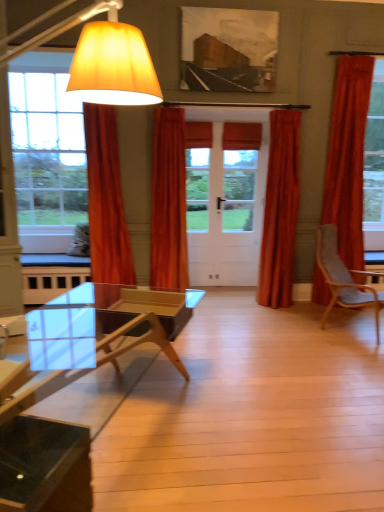
Question: Does velvet orange curtain at left, the 4th curtain viewed from the right, have a lesser height compared to velvet orange curtain at right, arranged as the 4th curtain when viewed from the left?

Choices:
 (A) no
 (B) yes

Answer: (B)

Question: Considering the relative sizes of velvet orange curtain at left, acting as the first curtain starting from the left, and velvet orange curtain at right, arranged as the 4th curtain when viewed from the left, in the image provided, is velvet orange curtain at left, acting as the first curtain starting from the left, smaller than velvet orange curtain at right, arranged as the 4th curtain when viewed from the left,?

Choices:
 (A) yes
 (B) no

Answer: (A)

Question: Could velvet orange curtain at right, placed as the 1th curtain when sorted from right to left, be considered to be inside velvet orange curtain at left, the 4th curtain viewed from the right?

Choices:
 (A) yes
 (B) no

Answer: (B)

Question: From the image's perspective, does velvet orange curtain at left, the 4th curtain viewed from the right, appear lower than velvet orange curtain at right, arranged as the 4th curtain when viewed from the left?

Choices:
 (A) no
 (B) yes

Answer: (B)

Question: Does velvet orange curtain at left, acting as the first curtain starting from the left, turn towards velvet orange curtain at right, placed as the 1th curtain when sorted from right to left?

Choices:
 (A) yes
 (B) no

Answer: (B)

Question: Is matte yellow fabric lampshade at left in front of or behind gray fabric chair at right in the image?

Choices:
 (A) front
 (B) behind

Answer: (A)

Question: From a real-world perspective, is matte yellow fabric lampshade at left positioned above or below gray fabric chair at right?

Choices:
 (A) above
 (B) below

Answer: (A)

Question: From their relative heights in the image, would you say matte yellow fabric lampshade at left is taller or shorter than gray fabric chair at right?

Choices:
 (A) tall
 (B) short

Answer: (A)

Question: Would you say matte yellow fabric lampshade at left is to the left or to the right of gray fabric chair at right in the picture?

Choices:
 (A) left
 (B) right

Answer: (A)

Question: Is transparent glass coffee table at lower left spatially inside velvet orange curtain at left, acting as the first curtain starting from the left, or outside of it?

Choices:
 (A) inside
 (B) outside

Answer: (B)

Question: Considering the positions of transparent glass coffee table at lower left and velvet orange curtain at left, the 4th curtain viewed from the right, in the image, is transparent glass coffee table at lower left wider or thinner than velvet orange curtain at left, the 4th curtain viewed from the right,?

Choices:
 (A) wide
 (B) thin

Answer: (A)

Question: From the image's perspective, is transparent glass coffee table at lower left above or below velvet orange curtain at left, acting as the first curtain starting from the left?

Choices:
 (A) below
 (B) above

Answer: (A)

Question: Would you say transparent glass coffee table at lower left is to the left or to the right of velvet orange curtain at left, the 4th curtain viewed from the right, in the picture?

Choices:
 (A) left
 (B) right

Answer: (B)

Question: Visually, is satin orange curtain at center, the third curtain when ordered from left to right, positioned to the left or to the right of transparent glass coffee table at lower left?

Choices:
 (A) left
 (B) right

Answer: (B)

Question: From the image's perspective, relative to transparent glass coffee table at lower left, is satin orange curtain at center, the third curtain when ordered from left to right, above or below?

Choices:
 (A) above
 (B) below

Answer: (A)